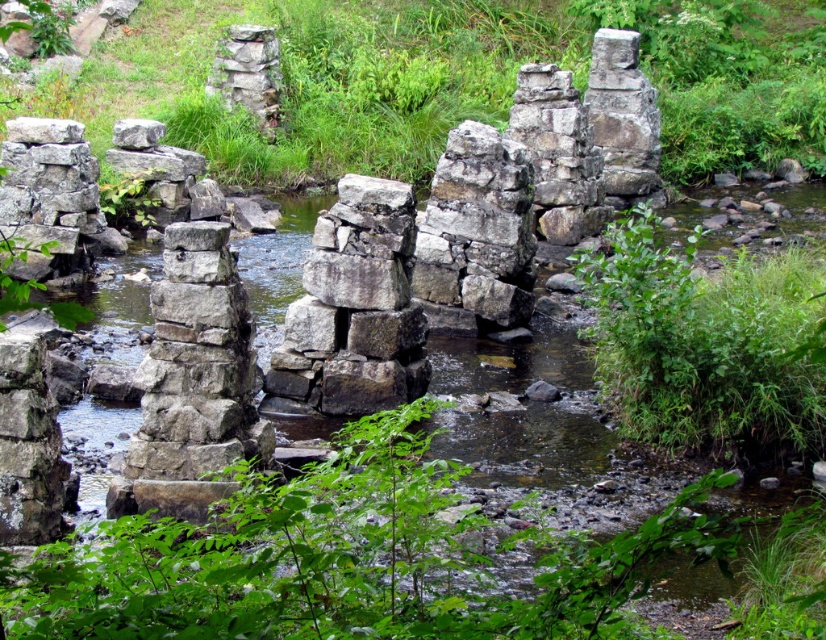
Which is above, natural stone bridge at center or green leafy plant at right?

natural stone bridge at center is higher up.

From the picture: Which is below, natural stone bridge at center or green leafy plant at right?

Positioned lower is green leafy plant at right.

Is point (355, 275) farther from viewer compared to point (630, 218)?

No, it is in front of (630, 218).

Find the location of a particular element. Image resolution: width=826 pixels, height=640 pixels. natural stone bridge at center is located at coordinates (435, 252).